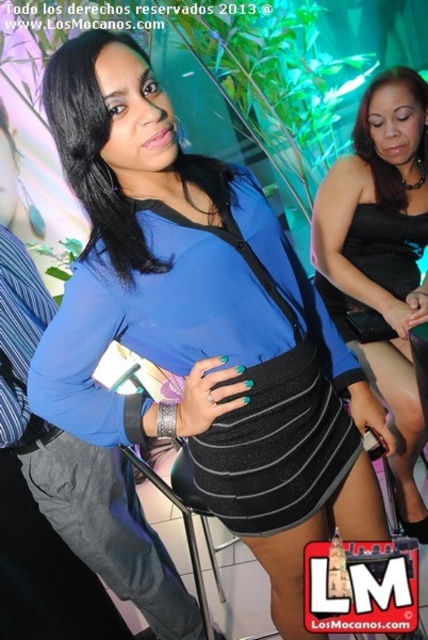
Question: Is black matte skirt at center behind black satin dress at center?

Choices:
 (A) no
 (B) yes

Answer: (A)

Question: Which point is farther to the camera?

Choices:
 (A) (136, 250)
 (B) (297, 365)

Answer: (B)

Question: Considering the relative positions of black satin dress at center and matte blue top at center in the image provided, where is black satin dress at center located with respect to matte blue top at center?

Choices:
 (A) below
 (B) above

Answer: (A)

Question: Can you confirm if black satin dress at center is positioned to the right of matte blue top at center?

Choices:
 (A) no
 (B) yes

Answer: (B)

Question: Which object appears closest to the camera in this image?

Choices:
 (A) black matte skirt at center
 (B) black satin dress at center
 (C) matte blue top at center

Answer: (C)

Question: Which point is farther to the camera?

Choices:
 (A) matte blue top at center
 (B) black matte skirt at center
 (C) black satin dress at center

Answer: (C)